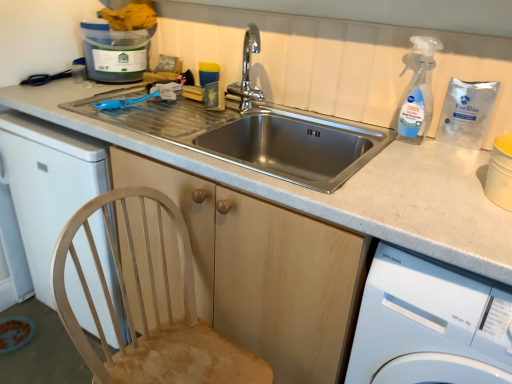
Question: From the image's perspective, is white glossy washing machine at lower right positioned above or below blue plastic container at upper left?

Choices:
 (A) above
 (B) below

Answer: (B)

Question: Is white glossy washing machine at lower right spatially inside blue plastic container at upper left, or outside of it?

Choices:
 (A) outside
 (B) inside

Answer: (A)

Question: Estimate the real-world distances between objects in this image. Which object is closer to the blue plastic container at upper left?

Choices:
 (A) wooden cabinet at center
 (B) transparent plastic spray bottle at upper right
 (C) natural wood chair at lower left
 (D) white glossy washing machine at lower right
 (E) stainless steel sink at center

Answer: (E)

Question: Estimate the real-world distances between objects in this image. Which object is closer to the transparent plastic spray bottle at upper right?

Choices:
 (A) white glossy washing machine at lower right
 (B) blue plastic container at upper left
 (C) natural wood chair at lower left
 (D) stainless steel sink at center
 (E) wooden cabinet at center

Answer: (D)